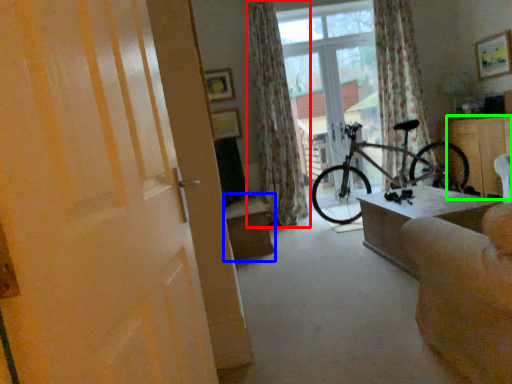
Question: Which is farther away from curtain (highlighted by a red box)? table (highlighted by a blue box) or cabinetry (highlighted by a green box)?

Choices:
 (A) table
 (B) cabinetry

Answer: (B)